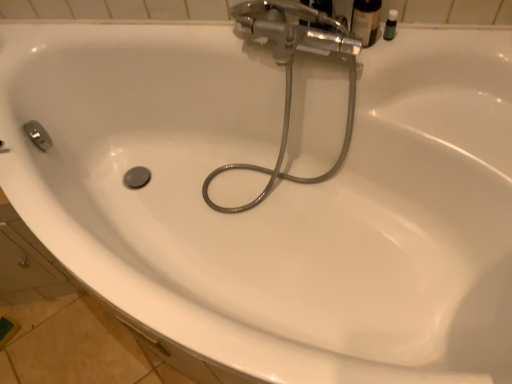
Question: Is green matte bottle at upper right, which appears as the 1th toiletry when viewed from the right, surrounding matte black bottle at upper right, the second toiletry from the right?

Choices:
 (A) no
 (B) yes

Answer: (A)

Question: Does green matte bottle at upper right, the second toiletry when ordered from left to right, have a lesser width compared to matte black bottle at upper right, the second toiletry from the right?

Choices:
 (A) no
 (B) yes

Answer: (B)

Question: From the image's perspective, is green matte bottle at upper right, the second toiletry when ordered from left to right, under matte black bottle at upper right, the first toiletry from the left?

Choices:
 (A) yes
 (B) no

Answer: (A)

Question: Does green matte bottle at upper right, which appears as the 1th toiletry when viewed from the right, have a lesser height compared to matte black bottle at upper right, the second toiletry from the right?

Choices:
 (A) no
 (B) yes

Answer: (B)

Question: Is green matte bottle at upper right, the second toiletry when ordered from left to right, behind matte black bottle at upper right, the second toiletry from the right?

Choices:
 (A) yes
 (B) no

Answer: (A)

Question: Is green matte bottle at upper right, which appears as the 1th toiletry when viewed from the right, with matte black bottle at upper right, the second toiletry from the right?

Choices:
 (A) yes
 (B) no

Answer: (A)

Question: Would you say metallic hose at center is a long distance from green matte bottle at upper right, which appears as the 1th toiletry when viewed from the right?

Choices:
 (A) yes
 (B) no

Answer: (B)

Question: Could you tell me if metallic hose at center is facing green matte bottle at upper right, which appears as the 1th toiletry when viewed from the right?

Choices:
 (A) yes
 (B) no

Answer: (B)

Question: From the image's perspective, is metallic hose at center located above green matte bottle at upper right, the second toiletry when ordered from left to right?

Choices:
 (A) yes
 (B) no

Answer: (B)

Question: Can you confirm if metallic hose at center is thinner than green matte bottle at upper right, which appears as the 1th toiletry when viewed from the right?

Choices:
 (A) yes
 (B) no

Answer: (B)

Question: Considering the relative sizes of metallic hose at center and green matte bottle at upper right, which appears as the 1th toiletry when viewed from the right, in the image provided, is metallic hose at center bigger than green matte bottle at upper right, which appears as the 1th toiletry when viewed from the right,?

Choices:
 (A) no
 (B) yes

Answer: (B)

Question: Is metallic hose at center shorter than green matte bottle at upper right, which appears as the 1th toiletry when viewed from the right?

Choices:
 (A) yes
 (B) no

Answer: (B)

Question: From the image's perspective, does green matte bottle at upper right, the second toiletry when ordered from left to right, appear lower than metallic hose at center?

Choices:
 (A) no
 (B) yes

Answer: (A)